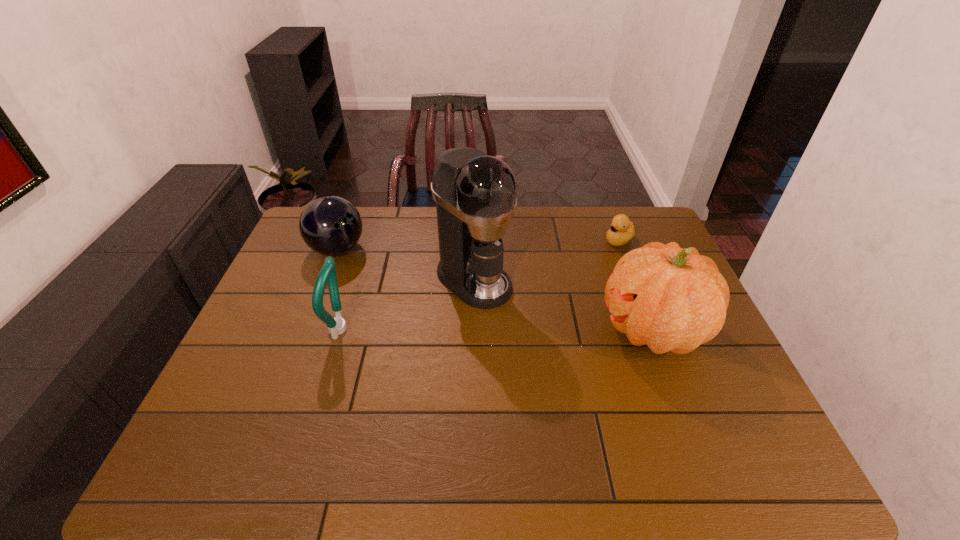
You are a GUI agent. You are given a task and a screenshot of the screen. Output one action in this format:
    pyautogui.click(x=<x>, y=<y>)
    Task: Click on the blank space located 0.360m facing forward on the shortest object
    This screenshot has height=540, width=960.
    Given the screenshot: What is the action you would take?
    pyautogui.click(x=538, y=297)

This screenshot has height=540, width=960. I want to click on free region located facing forward on the shortest object, so click(578, 268).

Locate an element on the screen. vacant area located facing forward on the shortest object is located at coordinates (541, 294).

Image resolution: width=960 pixels, height=540 pixels. In order to click on vacant space situated 0.190m on the side of the second shortest object with the finger holes in this screenshot , I will do `click(401, 284)`.

Where is `vacant space situated 0.230m on the side of the second shortest object with the finger holes`? vacant space situated 0.230m on the side of the second shortest object with the finger holes is located at coordinates (411, 289).

This screenshot has height=540, width=960. I want to click on free region located 0.190m on the side of the second shortest object with the finger holes, so click(x=401, y=284).

Locate an element on the screen. Image resolution: width=960 pixels, height=540 pixels. free space located 0.160m place cup under the spout of the tallest object is located at coordinates (539, 334).

Where is `free space located place cup under the spout of the tallest object`? free space located place cup under the spout of the tallest object is located at coordinates (608, 390).

This screenshot has width=960, height=540. I want to click on vacant space located place cup under the spout of the tallest object, so click(516, 315).

The width and height of the screenshot is (960, 540). What are the coordinates of `duckling positioned at the far edge` in the screenshot? It's located at (622, 230).